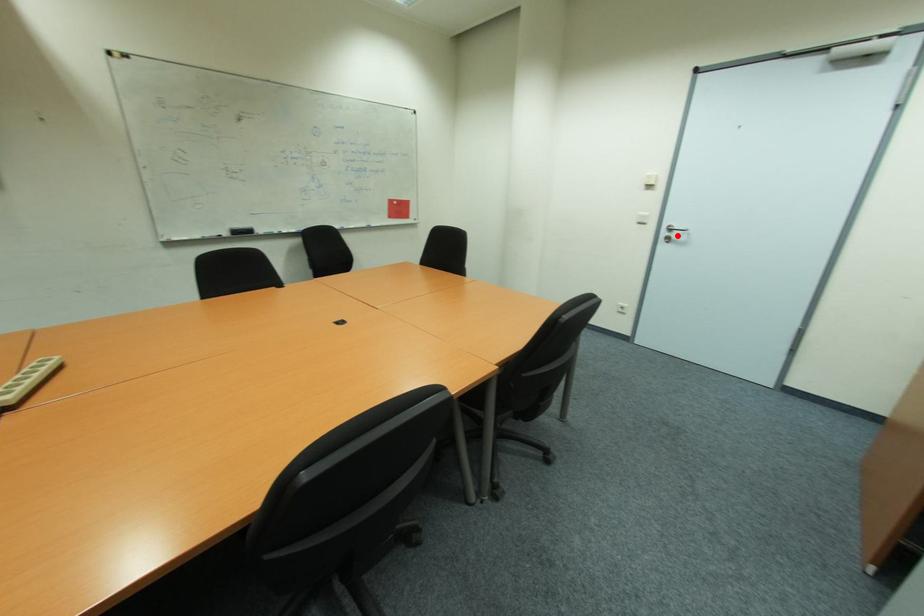
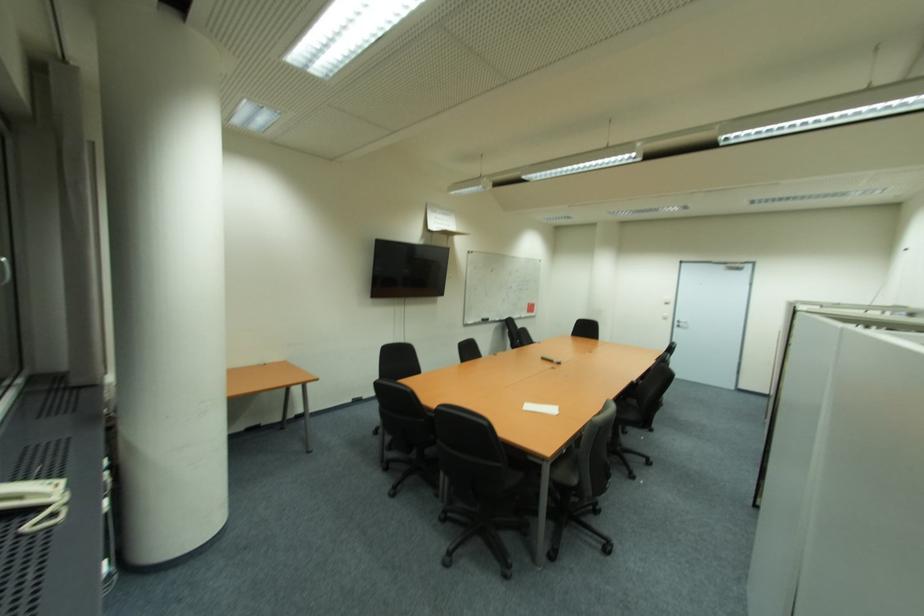
Where in the second image is the point corresponding to the highlighted location from the first image?

(686, 325)